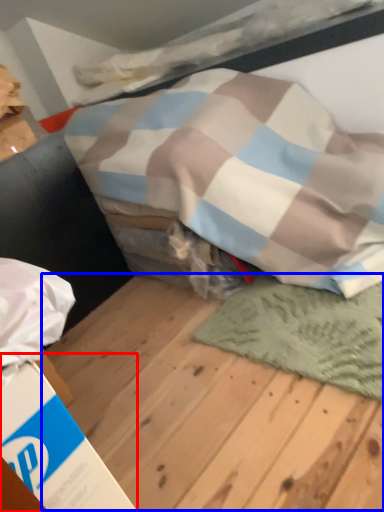
Question: Which object is further to the camera taking this photo, cardboard box (highlighted by a red box) or plywood (highlighted by a blue box)?

Choices:
 (A) cardboard box
 (B) plywood

Answer: (A)